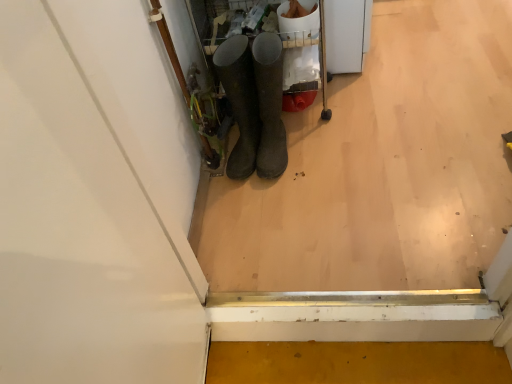
At what (x,y) coordinates should I click in order to perform the action: click on free space that is to the left of dark brown rubber boots at center. Please return your answer as a coordinate pair (x, y). Looking at the image, I should click on (225, 178).